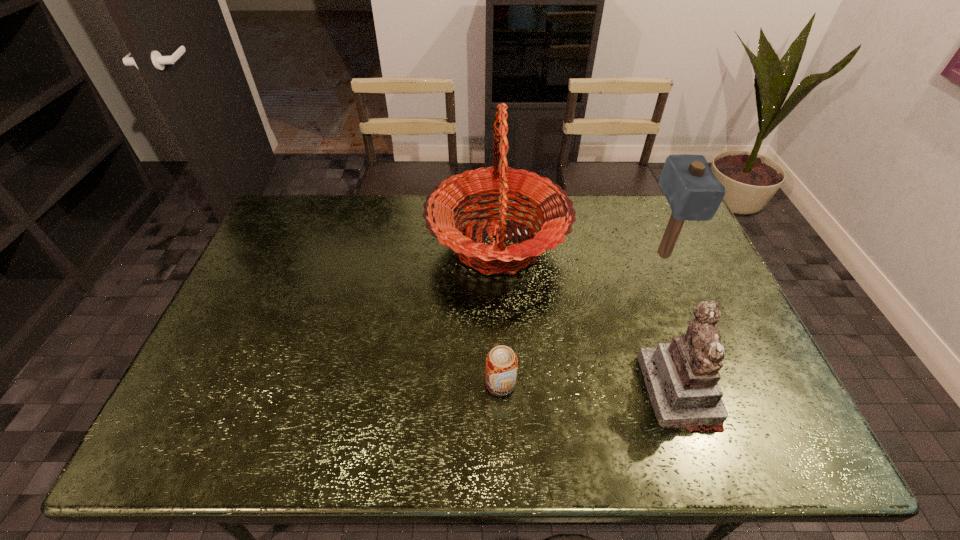
Where is `free location at the right edge of the desktop`? free location at the right edge of the desktop is located at coordinates (695, 240).

In order to click on vacant space at the far right corner of the desktop in this screenshot , I will do `click(669, 214)`.

The width and height of the screenshot is (960, 540). I want to click on unoccupied area between the figurine and the basket, so click(588, 318).

Where is `vacant space in between the second shortest object and the shortest object`? vacant space in between the second shortest object and the shortest object is located at coordinates (589, 388).

Where is `vacant space that is in between the tallest object and the beer can`? The image size is (960, 540). vacant space that is in between the tallest object and the beer can is located at coordinates (499, 315).

Where is `vacant point located between the tallest object and the beer can`? The width and height of the screenshot is (960, 540). vacant point located between the tallest object and the beer can is located at coordinates (499, 315).

You are a GUI agent. You are given a task and a screenshot of the screen. Output one action in this format:
    pyautogui.click(x=<x>, y=<y>)
    Task: Click on the free point between the basket and the second shortest object
    The width and height of the screenshot is (960, 540).
    Given the screenshot: What is the action you would take?
    pyautogui.click(x=588, y=318)

I want to click on vacant area that lies between the mallet and the basket, so click(x=581, y=249).

I want to click on empty space that is in between the mallet and the figurine, so click(x=671, y=322).

This screenshot has height=540, width=960. I want to click on empty location between the tallest object and the mallet, so click(x=581, y=249).